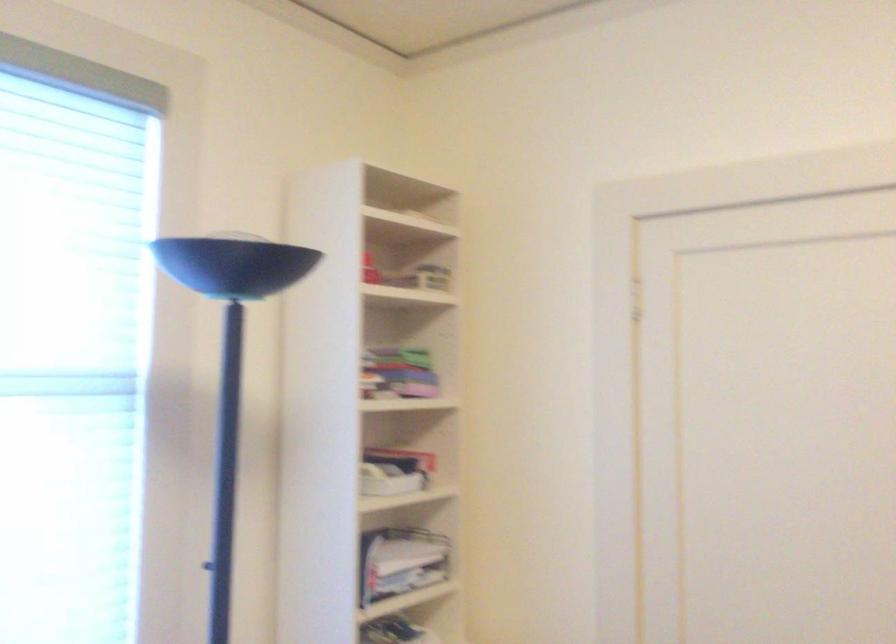
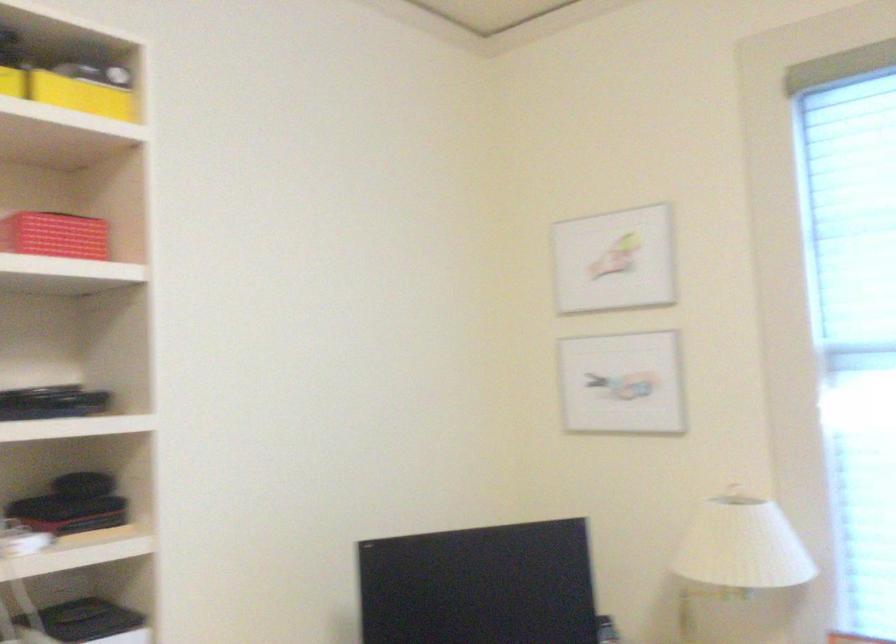
Question: The camera is either moving clockwise (left) or counter-clockwise (right) around the object. The first image is from the beginning of the video and the second image is from the end. Is the camera moving left or right when shooting the video?

Choices:
 (A) Left
 (B) Right

Answer: (B)